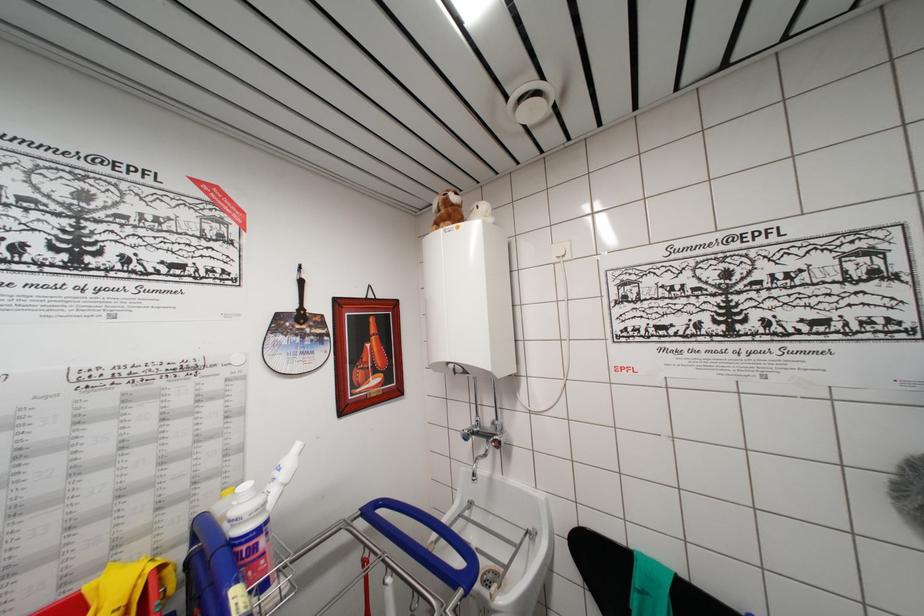
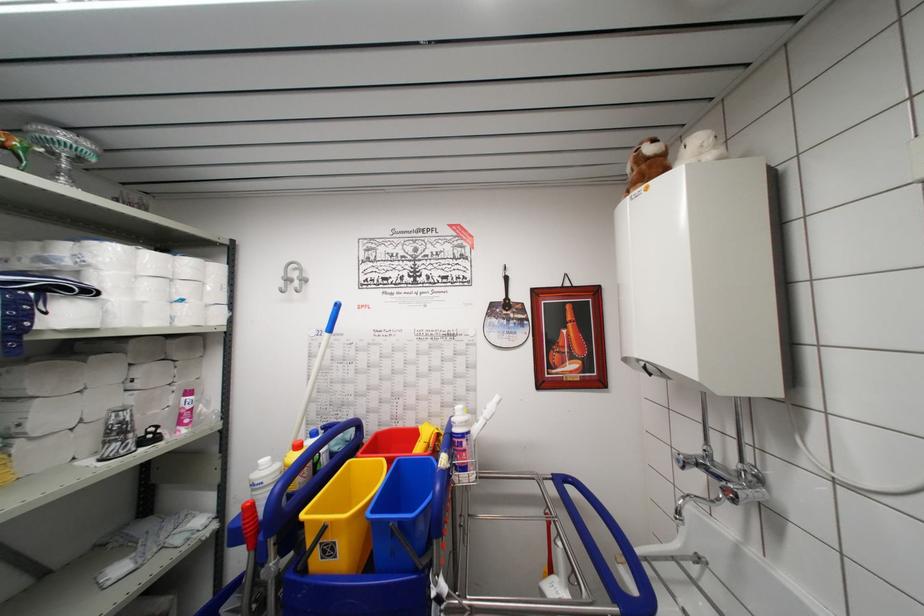
Find the pixel in the second image that matches [362,524] in the first image.

(554, 487)